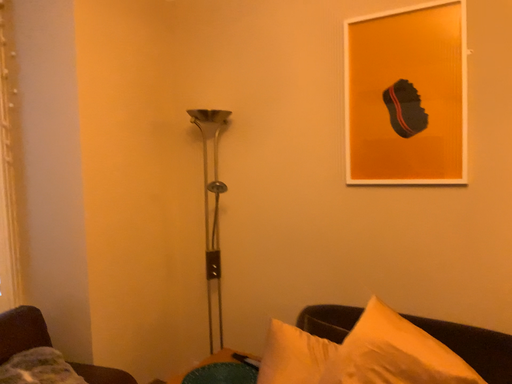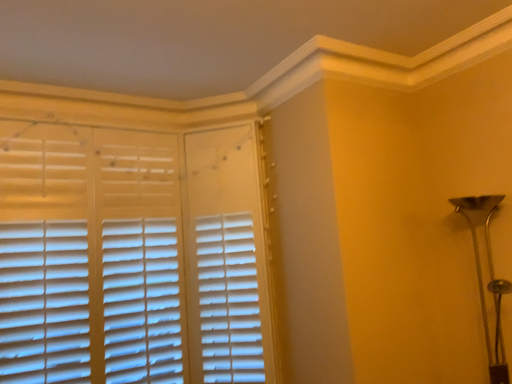
Question: Which way did the camera rotate in the video?

Choices:
 (A) rotated right
 (B) rotated left

Answer: (B)